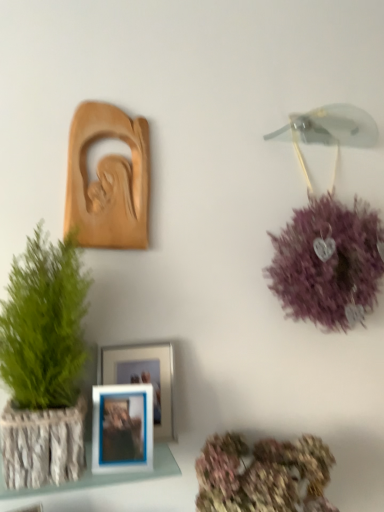
Question: Is point (244, 487) positioned closer to the camera than point (139, 362)?

Choices:
 (A) closer
 (B) farther

Answer: (A)

Question: Considering the positions of pastel floral bouquet at lower center and blue plastic picture frame at center, acting as the 2th picture frame starting from the top, in the image, is pastel floral bouquet at lower center wider or thinner than blue plastic picture frame at center, acting as the 2th picture frame starting from the top,?

Choices:
 (A) wide
 (B) thin

Answer: (A)

Question: Which object is the farthest from the white textured frame at lower left?

Choices:
 (A) matte wood carving at upper left, the third picture frame when ordered from bottom to top
 (B) blue plastic picture frame at center, placed as the first picture frame when sorted from bottom to top
 (C) purple fluffy wreath at upper right
 (D) blue plastic picture frame at center, acting as the 2th picture frame starting from the top
 (E) pastel floral bouquet at lower center

Answer: (C)

Question: Which object is positioned farthest from the matte wood carving at upper left, the third picture frame when ordered from bottom to top?

Choices:
 (A) blue plastic picture frame at center, acting as the 2th picture frame starting from the top
 (B) white textured frame at lower left
 (C) blue plastic picture frame at center, the third picture frame in the top-to-bottom sequence
 (D) purple fluffy wreath at upper right
 (E) pastel floral bouquet at lower center

Answer: (E)